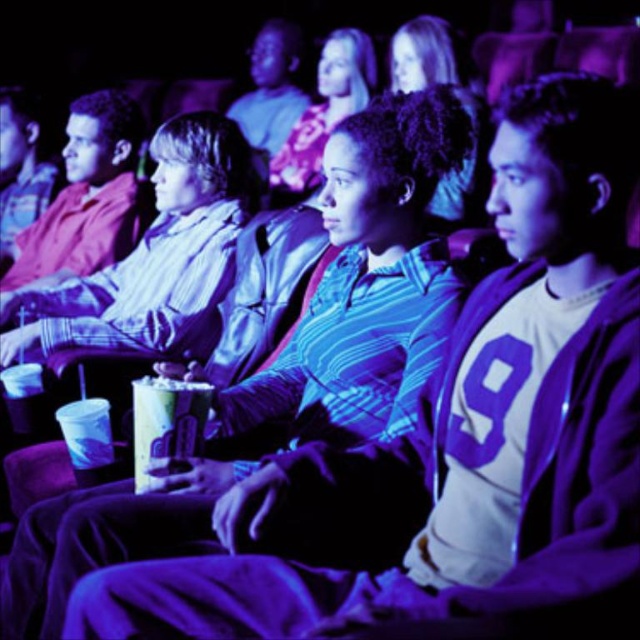
You are trying to place a small toy between the matte blue shirt at center and the translucent plastic cup at center. Based on their positions, can the toy fit between them?

The matte blue shirt at center might be wider than the translucent plastic cup at center, so there might not be enough space for the toy to fit between them.

You are sitting in the movie theater and want to know which of the two points, point (358, 84) or point (200, 390), is closer to you. Based on the scene description, can you determine which point is nearer?

Point (358, 84) is further to the camera than point (200, 390), so the point closer to you is point (200, 390).